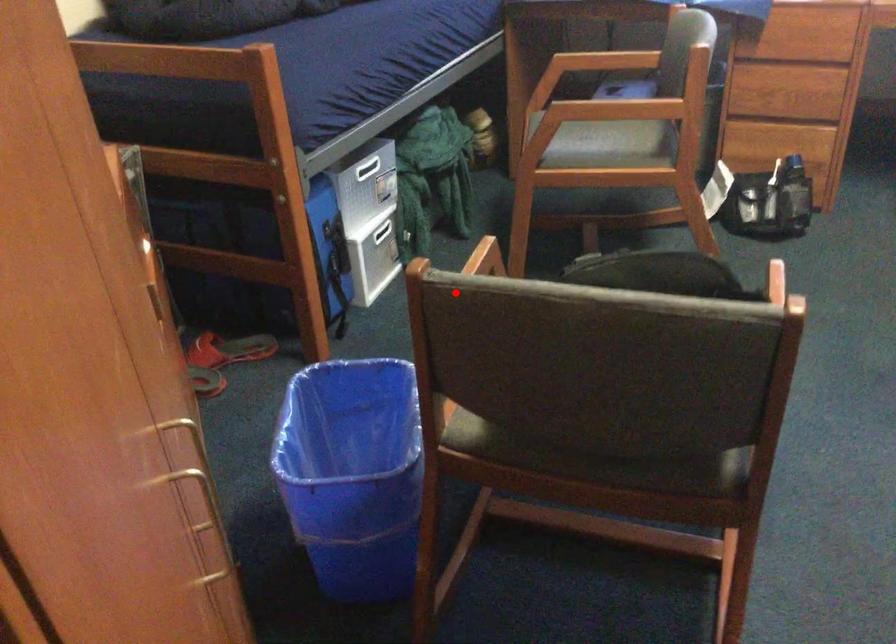
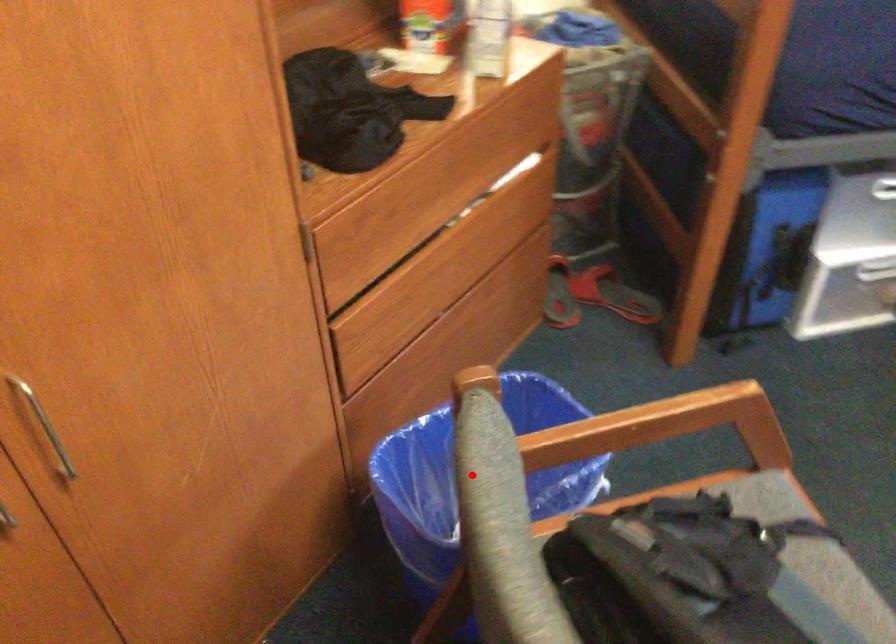
I am providing you with two images of the same scene from different viewpoints. A red point is marked on the first image and another point is marked on the second image. Does the point marked in image1 correspond to the same location as the one in image2?

Yes